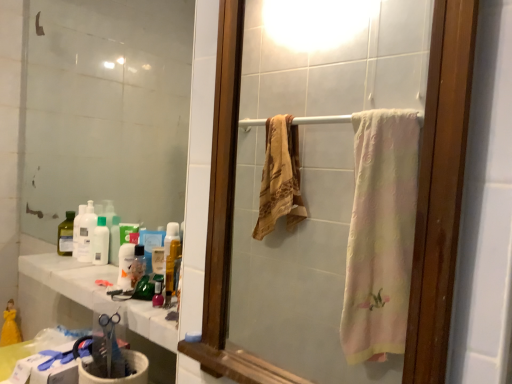
In order to face translucent plastic bottle at center, should I rotate leftwards or rightwards?

Rotate left and turn 15.107 degrees.

This screenshot has width=512, height=384. Describe the element at coordinates (332, 188) in the screenshot. I see `wooden frame mirror at center, the second mirror from the left` at that location.

In order to face clear glass mirror at upper left, the 2th mirror in the right-to-left sequence, should I rotate leftwards or rightwards?

Rotate left and turn 21.449 degrees.

The width and height of the screenshot is (512, 384). In order to click on clear glass mirror at upper left, the 1th mirror in the left-to-right sequence in this screenshot , I will do `click(106, 110)`.

What are the coordinates of `translucent plastic bottle at center` in the screenshot? It's located at (138, 265).

From the image's perspective, is translucent plastic bottle at left, which is counted as the 1th cleaning product, starting from the right, below translucent plastic bottle at lower center?

Actually, translucent plastic bottle at left, which is counted as the 1th cleaning product, starting from the right, appears above translucent plastic bottle at lower center in the image.

Are translucent plastic bottle at left, which is counted as the 1th cleaning product, starting from the right, and translucent plastic bottle at lower center located far from each other?

Actually, translucent plastic bottle at left, which is counted as the 1th cleaning product, starting from the right, and translucent plastic bottle at lower center are a little close together.

Which object is positioned more to the right, translucent plastic bottle at left, placed as the 2th cleaning product when sorted from left to right, or translucent plastic bottle at lower center?

translucent plastic bottle at lower center.

Considering the relative positions of translucent plastic bottle at left, which is counted as the 1th cleaning product, starting from the right, and translucent plastic bottle at lower center in the image provided, is translucent plastic bottle at left, which is counted as the 1th cleaning product, starting from the right, behind translucent plastic bottle at lower center?

Yes, translucent plastic bottle at left, which is counted as the 1th cleaning product, starting from the right, is further from the camera.

Is white glossy countertop at lower left positioned before wooden frame mirror at center, the 1th mirror in the front-to-back sequence?

That is False.

Considering the relative sizes of white glossy countertop at lower left and wooden frame mirror at center, marked as the first mirror in a right-to-left arrangement, in the image provided, is white glossy countertop at lower left wider than wooden frame mirror at center, marked as the first mirror in a right-to-left arrangement,?

Yes.

Is white glossy countertop at lower left facing away from wooden frame mirror at center, which ranks as the 2th mirror in back-to-front order?

No, white glossy countertop at lower left is not facing the opposite direction of wooden frame mirror at center, which ranks as the 2th mirror in back-to-front order.

Which point is more distant from viewer, (87, 240) or (101, 27)?

Point (101, 27)

Is translucent plastic bottle at left, arranged as the first cleaning product when viewed from the left, in front of or behind clear glass mirror at upper left, acting as the first mirror starting from the back, in the image?

Visually, translucent plastic bottle at left, arranged as the first cleaning product when viewed from the left, is located behind clear glass mirror at upper left, acting as the first mirror starting from the back.

Is translucent plastic bottle at left, arranged as the first cleaning product when viewed from the left, turned away from clear glass mirror at upper left, which is the second mirror in front-to-back order?

Yes, translucent plastic bottle at left, arranged as the first cleaning product when viewed from the left, is facing away from clear glass mirror at upper left, which is the second mirror in front-to-back order.

From a real-world perspective, is clear glass mirror at upper left, the 1th mirror in the left-to-right sequence, above or below translucent plastic bottle at left, which is counted as the 1th cleaning product, starting from the right?

Clearly, from a real-world perspective, clear glass mirror at upper left, the 1th mirror in the left-to-right sequence, is above translucent plastic bottle at left, which is counted as the 1th cleaning product, starting from the right.

From the image's perspective, which is below, clear glass mirror at upper left, acting as the first mirror starting from the back, or translucent plastic bottle at left, which is counted as the 1th cleaning product, starting from the right?

translucent plastic bottle at left, which is counted as the 1th cleaning product, starting from the right.

Can you tell me how much clear glass mirror at upper left, which is the second mirror in front-to-back order, and translucent plastic bottle at left, placed as the 2th cleaning product when sorted from left to right, differ in facing direction?

There is a 0.581-degree angle between the facing directions of clear glass mirror at upper left, which is the second mirror in front-to-back order, and translucent plastic bottle at left, placed as the 2th cleaning product when sorted from left to right.

Is clear glass mirror at upper left, the 1th mirror in the left-to-right sequence, placed right next to translucent plastic bottle at left, placed as the 2th cleaning product when sorted from left to right?

No, clear glass mirror at upper left, the 1th mirror in the left-to-right sequence, is not touching translucent plastic bottle at left, placed as the 2th cleaning product when sorted from left to right.

From the image's perspective, which is above, translucent plastic bottle at left, which is the 2th cleaning product in right-to-left order, or white glossy countertop at lower left?

translucent plastic bottle at left, which is the 2th cleaning product in right-to-left order, is shown above in the image.

Which point is more distant from viewer, (84, 222) or (74, 272)?

The point (84, 222) is farther.

Which of these two, translucent plastic bottle at left, arranged as the first cleaning product when viewed from the left, or white glossy countertop at lower left, is thinner?

With smaller width is translucent plastic bottle at left, arranged as the first cleaning product when viewed from the left.

Between translucent plastic bottle at center and wooden frame mirror at center, the second mirror from the left, which one has larger size?

wooden frame mirror at center, the second mirror from the left, is bigger.

Does translucent plastic bottle at center appear on the right side of wooden frame mirror at center, which ranks as the 2th mirror in back-to-front order?

No, translucent plastic bottle at center is not to the right of wooden frame mirror at center, which ranks as the 2th mirror in back-to-front order.

From the image's perspective, is translucent plastic bottle at center under wooden frame mirror at center, the 1th mirror in the front-to-back sequence?

Yes.

In the image, is translucent plastic bottle at center positioned in front of or behind wooden frame mirror at center, the 1th mirror in the front-to-back sequence?

translucent plastic bottle at center is behind wooden frame mirror at center, the 1th mirror in the front-to-back sequence.

Considering the sizes of objects translucent plastic bottle at left, which is the 2th cleaning product in right-to-left order, and translucent plastic bottle at center in the image provided, who is thinner, translucent plastic bottle at left, which is the 2th cleaning product in right-to-left order, or translucent plastic bottle at center?

translucent plastic bottle at center is thinner.

Is point (91, 214) less distant than point (132, 263)?

No, it is not.

From the image's perspective, would you say translucent plastic bottle at left, which is the 2th cleaning product in right-to-left order, is shown under translucent plastic bottle at center?

No, from the image's perspective, translucent plastic bottle at left, which is the 2th cleaning product in right-to-left order, is not below translucent plastic bottle at center.

Considering the sizes of objects translucent plastic bottle at left, which is the 2th cleaning product in right-to-left order, and translucent plastic bottle at center in the image provided, who is taller, translucent plastic bottle at left, which is the 2th cleaning product in right-to-left order, or translucent plastic bottle at center?

With more height is translucent plastic bottle at left, which is the 2th cleaning product in right-to-left order.

Identify the location of the 1st cleaning product positioned above the translucent plastic bottle at lower center (from the image's perspective). The width and height of the screenshot is (512, 384). (100, 242).

Locate an element on the screen. counter top located behind the wooden frame mirror at center, which ranks as the 2th mirror in back-to-front order is located at coordinates (99, 294).

Looking at the image, which one is located further to translucent plastic bottle at lower center, white glossy countertop at lower left or translucent plastic bottle at left, which is the 2th cleaning product in right-to-left order?

translucent plastic bottle at left, which is the 2th cleaning product in right-to-left order, is positioned further to the anchor translucent plastic bottle at lower center.

Which object lies further to the anchor point translucent plastic bottle at lower center, clear glass mirror at upper left, the 2th mirror in the right-to-left sequence, or translucent plastic bottle at center?

clear glass mirror at upper left, the 2th mirror in the right-to-left sequence, lies further to translucent plastic bottle at lower center than the other object.

Looking at the image, which one is located further to white glossy countertop at lower left, wooden frame mirror at center, the second mirror from the left, or translucent plastic bottle at left, which is counted as the 1th cleaning product, starting from the right?

Based on the image, wooden frame mirror at center, the second mirror from the left, appears to be further to white glossy countertop at lower left.

Considering their positions, is clear glass mirror at upper left, acting as the first mirror starting from the back, positioned closer to white glossy countertop at lower left than translucent plastic bottle at center?

Among the two, translucent plastic bottle at center is located nearer to white glossy countertop at lower left.

Considering their positions, is clear glass mirror at upper left, acting as the first mirror starting from the back, positioned closer to translucent plastic bottle at left, which is the 2th cleaning product in right-to-left order, than translucent plastic bottle at lower center?

Among the two, translucent plastic bottle at lower center is located nearer to translucent plastic bottle at left, which is the 2th cleaning product in right-to-left order.

When comparing their distances from white glossy countertop at lower left, does clear glass mirror at upper left, the 1th mirror in the left-to-right sequence, or wooden frame mirror at center, which ranks as the 2th mirror in back-to-front order, seem further?

wooden frame mirror at center, which ranks as the 2th mirror in back-to-front order.

Based on their spatial positions, is translucent plastic bottle at center or wooden frame mirror at center, marked as the first mirror in a right-to-left arrangement, closer to clear glass mirror at upper left, acting as the first mirror starting from the back?

Among the two, translucent plastic bottle at center is located nearer to clear glass mirror at upper left, acting as the first mirror starting from the back.

From the image, which object appears to be nearer to translucent plastic bottle at lower center, wooden frame mirror at center, the second mirror from the left, or translucent plastic bottle at left, which is counted as the 1th cleaning product, starting from the right?

The object closer to translucent plastic bottle at lower center is translucent plastic bottle at left, which is counted as the 1th cleaning product, starting from the right.

At what (x,y) coordinates should I click in order to perform the action: click on counter top between wooden frame mirror at center, the 1th mirror in the front-to-back sequence, and translucent plastic bottle at left, which is the 2th cleaning product in right-to-left order, from front to back. Please return your answer as a coordinate pair (x, y). The height and width of the screenshot is (384, 512). Looking at the image, I should click on (99, 294).

Where is `mouthwash located between wooden frame mirror at center, which ranks as the 2th mirror in back-to-front order, and translucent plastic bottle at left, which is counted as the 1th cleaning product, starting from the right, in the depth direction`? This screenshot has height=384, width=512. mouthwash located between wooden frame mirror at center, which ranks as the 2th mirror in back-to-front order, and translucent plastic bottle at left, which is counted as the 1th cleaning product, starting from the right, in the depth direction is located at coordinates click(x=158, y=292).

What are the coordinates of `mouthwash between wooden frame mirror at center, which ranks as the 2th mirror in back-to-front order, and clear glass mirror at upper left, which is the second mirror in front-to-back order, along the z-axis` in the screenshot? It's located at coord(158,292).

Where is `bottle between clear glass mirror at upper left, the 2th mirror in the right-to-left sequence, and white glossy countertop at lower left, in the vertical direction`? This screenshot has width=512, height=384. bottle between clear glass mirror at upper left, the 2th mirror in the right-to-left sequence, and white glossy countertop at lower left, in the vertical direction is located at coordinates (138, 265).